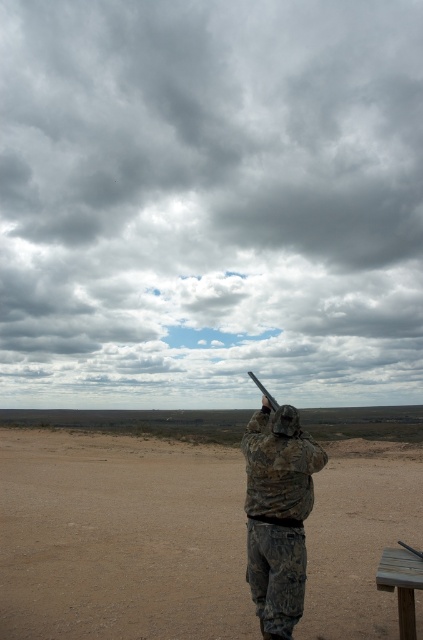
Is point (96, 484) closer to camera compared to point (269, 396)?

No, (96, 484) is behind (269, 396).

Which is behind, point (228, 499) or point (255, 381)?

The point (228, 499) is more distant.

Identify the location of dull brown dirt at center. (120, 538).

Which is more to the right, camouflage fabric soldier at center or matte black shotgun at upper center?

From the viewer's perspective, matte black shotgun at upper center appears more on the right side.

The image size is (423, 640). Describe the element at coordinates (277, 515) in the screenshot. I see `camouflage fabric soldier at center` at that location.

Is point (285, 406) in front of point (258, 384)?

Yes, point (285, 406) is in front of point (258, 384).

I want to click on camouflage fabric soldier at center, so click(277, 515).

Consider the image. Can you confirm if dull brown dirt at center is positioned to the left of camouflage fabric soldier at center?

Yes, dull brown dirt at center is to the left of camouflage fabric soldier at center.

Who is more distant from viewer, (x=249, y=600) or (x=247, y=552)?

Positioned behind is point (x=249, y=600).

Is point (359, 468) in front of point (266, 513)?

No, (359, 468) is further to viewer.

This screenshot has width=423, height=640. I want to click on dull brown dirt at center, so click(120, 538).